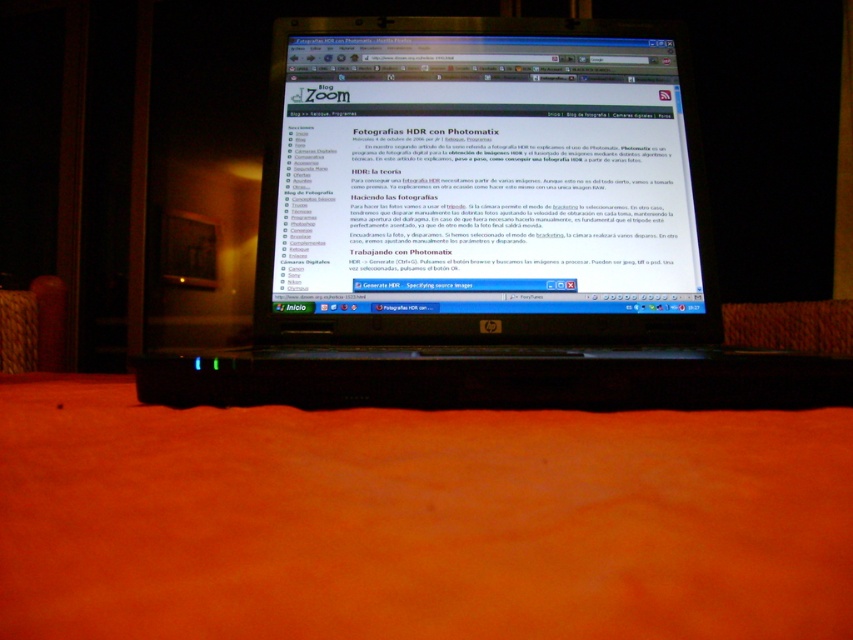
Question: Can you confirm if black plastic laptop at center is positioned below matte black monitor at center?

Choices:
 (A) yes
 (B) no

Answer: (A)

Question: Among these objects, which one is nearest to the camera?

Choices:
 (A) black plastic laptop at center
 (B) matte black monitor at center

Answer: (A)

Question: Does black plastic laptop at center appear on the right side of matte black monitor at center?

Choices:
 (A) no
 (B) yes

Answer: (A)

Question: Which point is closer to the camera?

Choices:
 (A) (561, 305)
 (B) (390, 384)

Answer: (B)

Question: Can you confirm if black plastic laptop at center is bigger than matte black monitor at center?

Choices:
 (A) yes
 (B) no

Answer: (A)